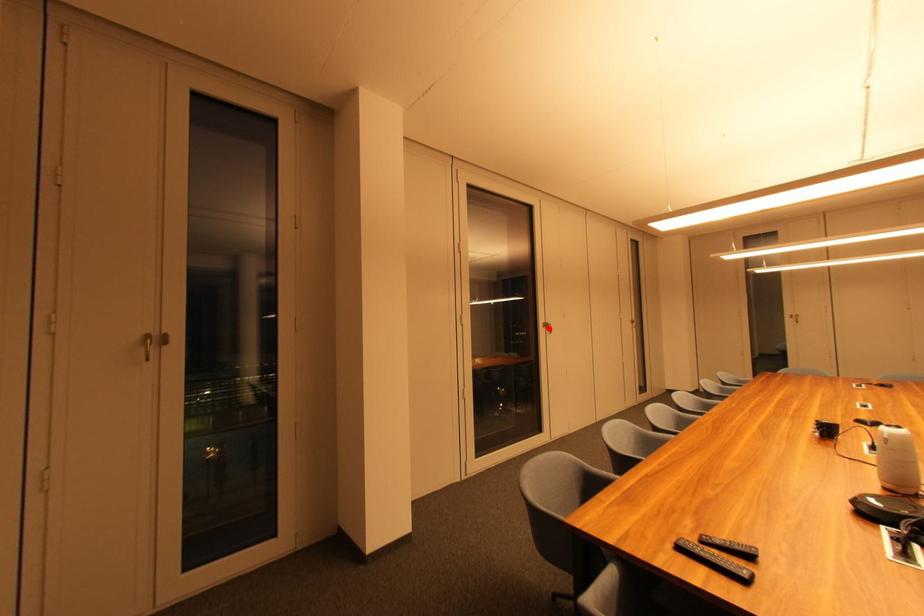
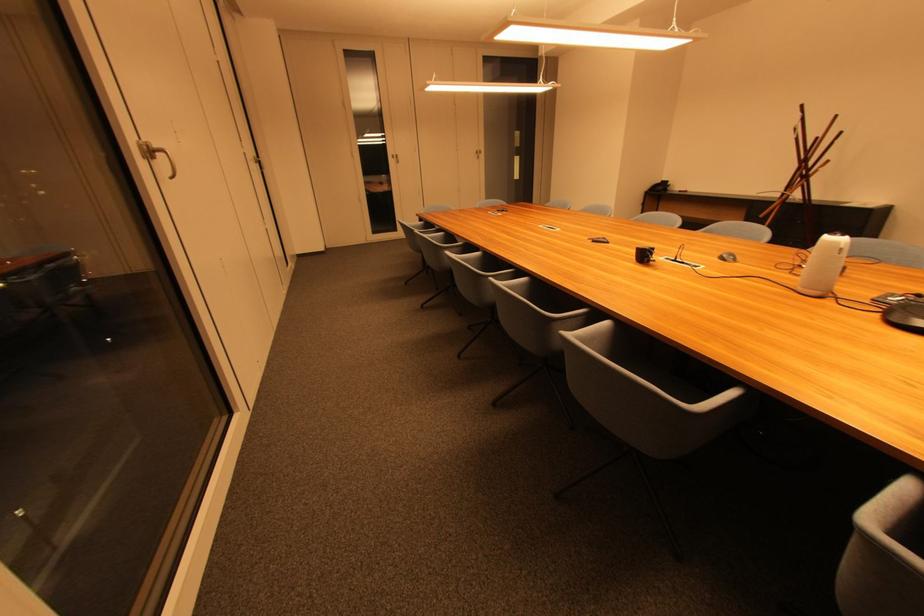
The point at the highlighted location is marked in the first image. Where is the corresponding point in the second image?

(148, 159)